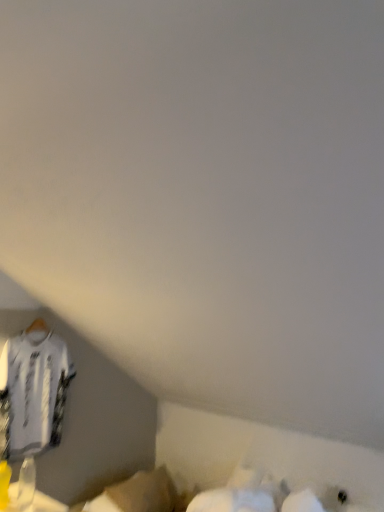
Question: From a real-world perspective, is white fabric at lower center positioned over white jersey at left based on gravity?

Choices:
 (A) no
 (B) yes

Answer: (A)

Question: Does white fabric at lower center have a greater width compared to white jersey at left?

Choices:
 (A) no
 (B) yes

Answer: (B)

Question: Considering the relative sizes of white fabric at lower center and white jersey at left in the image provided, is white fabric at lower center bigger than white jersey at left?

Choices:
 (A) yes
 (B) no

Answer: (B)

Question: Is the position of white fabric at lower center less distant than that of white jersey at left?

Choices:
 (A) yes
 (B) no

Answer: (B)

Question: From the image's perspective, is white fabric at lower center on top of white jersey at left?

Choices:
 (A) no
 (B) yes

Answer: (A)

Question: Considering the relative positions of white fabric at lower center and white jersey at left in the image provided, is white fabric at lower center to the right of white jersey at left from the viewer's perspective?

Choices:
 (A) no
 (B) yes

Answer: (B)

Question: Is white jersey at left oriented away from white fabric at lower center?

Choices:
 (A) no
 (B) yes

Answer: (A)

Question: Is white jersey at left surrounding white fabric at lower center?

Choices:
 (A) no
 (B) yes

Answer: (A)

Question: Can you confirm if white jersey at left is thinner than white fabric at lower center?

Choices:
 (A) no
 (B) yes

Answer: (B)

Question: Is white jersey at left positioned behind white fabric at lower center?

Choices:
 (A) no
 (B) yes

Answer: (A)

Question: Does white jersey at left lie in front of white fabric at lower center?

Choices:
 (A) yes
 (B) no

Answer: (A)

Question: Does white jersey at left have a larger size compared to white fabric at lower center?

Choices:
 (A) no
 (B) yes

Answer: (B)

Question: Relative to white jersey at left, is white fabric at lower center in front or behind?

Choices:
 (A) behind
 (B) front

Answer: (A)